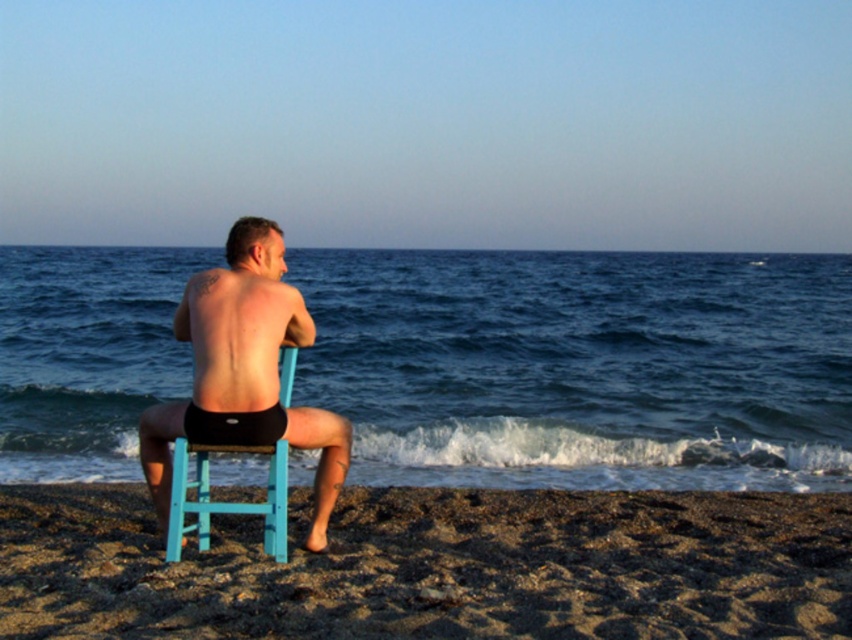
What is the location of the point with coordinates (x=583, y=365) in the beach scene?

The point with coordinates (x=583, y=365) corresponds to blue water at center.

You are a photographer trying to capture the man in the scene. You need to position your camera so that the black matte shorts at center and the light blue plastic chair at center are both in frame. According to the scene description, which object should appear to the right side of the camera frame?

The light blue plastic chair at center should appear to the right side of the camera frame because the black matte shorts at center are to the left of it.

You are standing at the beach and want to place a small flag exactly halfway between point (557, 467) and point (327, 484). Considering their positions relative to the camera, which direction should you move from the closer point to reach the halfway point?

Since point (557, 467) is closer to the camera than point (327, 484), you should move towards the direction away from the camera from point (557, 467) to reach the halfway point between them.